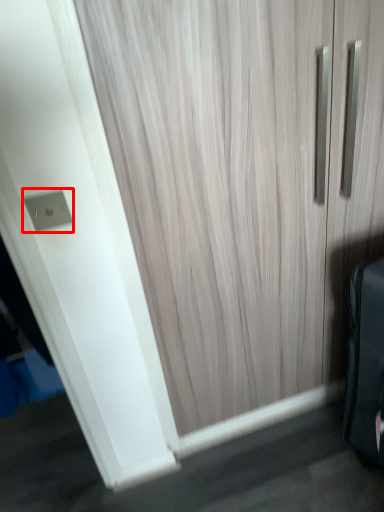
Question: Observing the image, what is the correct spatial positioning of electric outlet (annotated by the red box) in reference to door?

Choices:
 (A) right
 (B) left

Answer: (B)